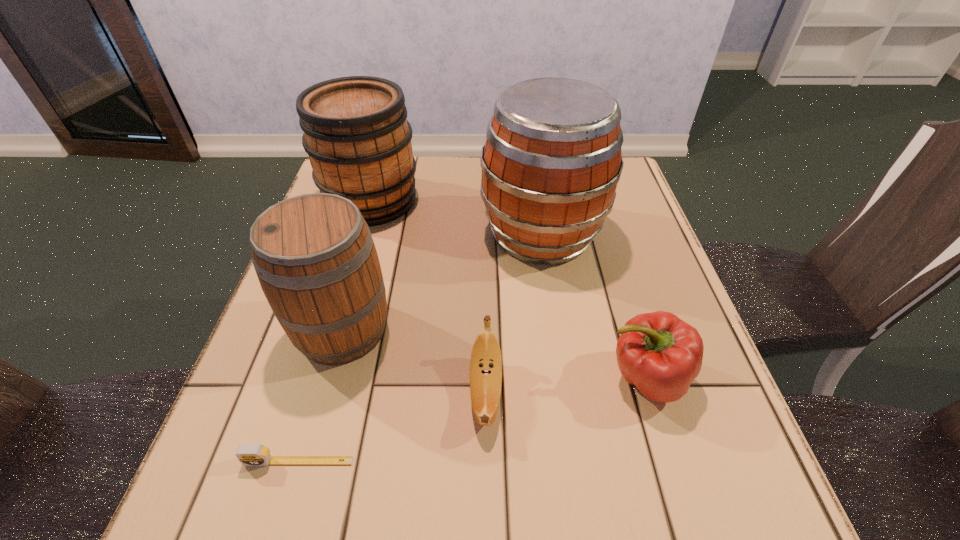
You are a GUI agent. You are given a task and a screenshot of the screen. Output one action in this format:
    pyautogui.click(x=<x>, y=<y>)
    Task: Click on the free point that satisfies the following two spatial constraints: 1. on the back side of the banana; 2. on the right side of the tallest cider
    
    Given the screenshot: What is the action you would take?
    pyautogui.click(x=484, y=233)